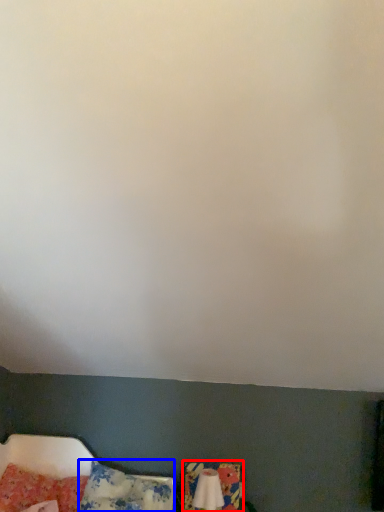
Question: Which object is further to the camera taking this photo, swivel chair (highlighted by a red box) or pillow (highlighted by a blue box)?

Choices:
 (A) swivel chair
 (B) pillow

Answer: (A)